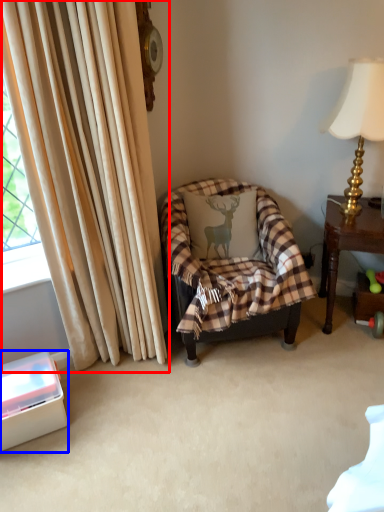
Question: Which object appears closest to the camera in this image, curtain (highlighted by a red box) or box (highlighted by a blue box)?

Choices:
 (A) curtain
 (B) box

Answer: (A)